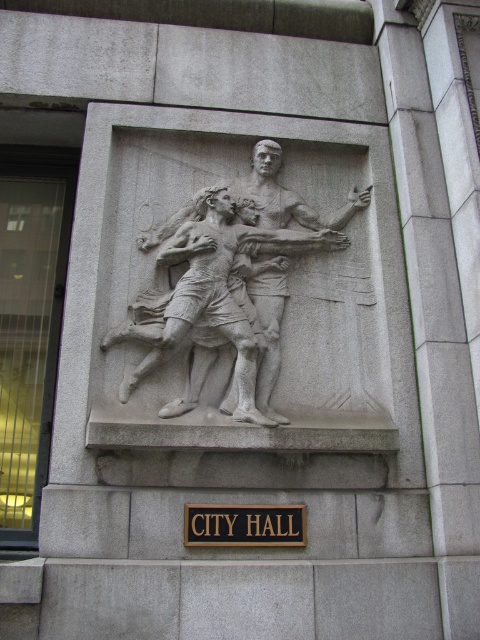
Question: Which point is farther from the camera taking this photo?

Choices:
 (A) click(x=275, y=360)
 (B) click(x=232, y=509)

Answer: (A)

Question: Where is gray stone relief at center located in relation to black wood sign at center in the image?

Choices:
 (A) right
 (B) left

Answer: (A)

Question: Which object appears farthest from the camera in this image?

Choices:
 (A) black wood sign at center
 (B) gray stone relief at center

Answer: (B)

Question: Among these objects, which one is nearest to the camera?

Choices:
 (A) black wood sign at center
 (B) gray stone relief at center

Answer: (A)

Question: Does gray stone relief at center have a greater width compared to black wood sign at center?

Choices:
 (A) no
 (B) yes

Answer: (B)

Question: Does gray stone relief at center have a smaller size compared to black wood sign at center?

Choices:
 (A) yes
 (B) no

Answer: (B)